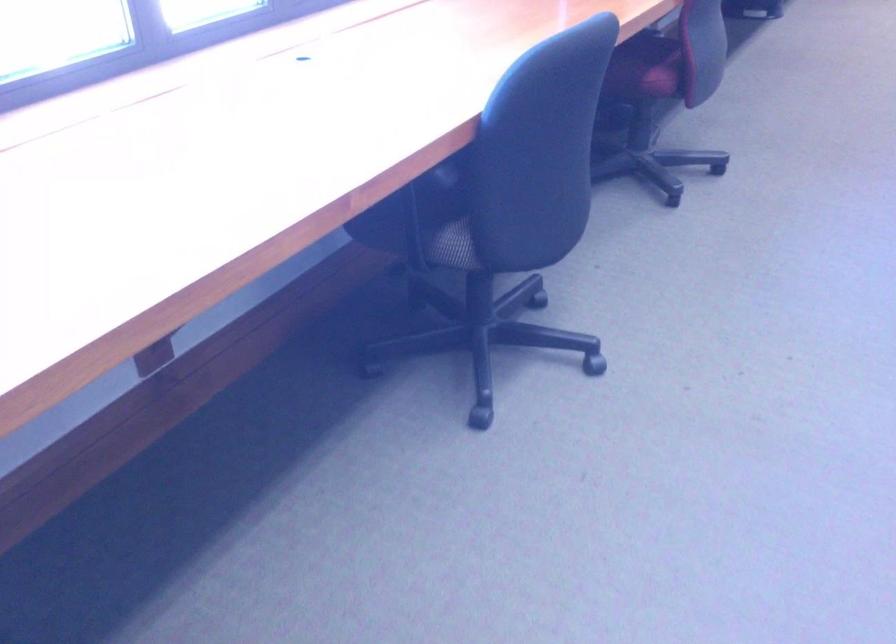
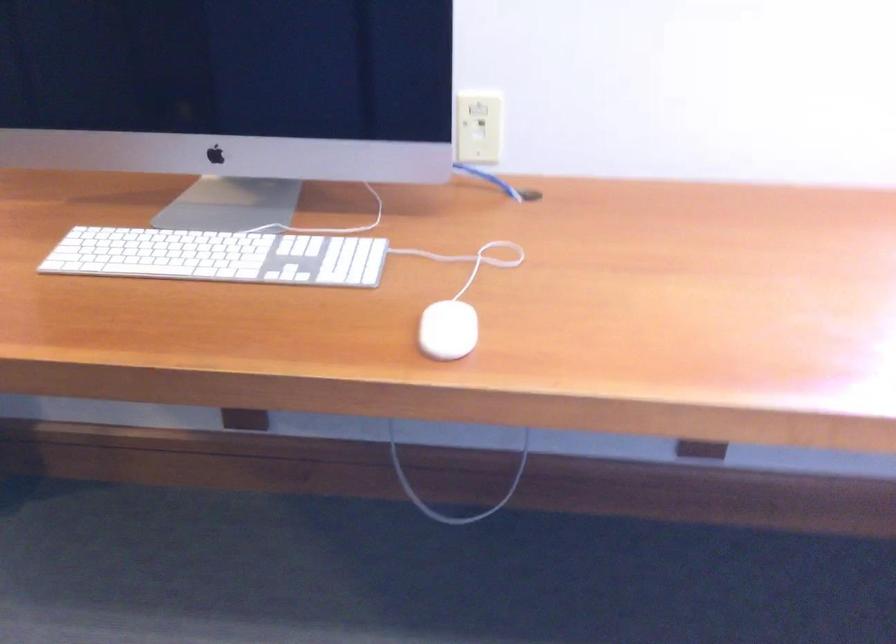
Question: The images are taken continuously from a first-person perspective. In which direction is your viewpoint rotating?

Choices:
 (A) Left
 (B) Right
 (C) Up
 (D) Down

Answer: (A)